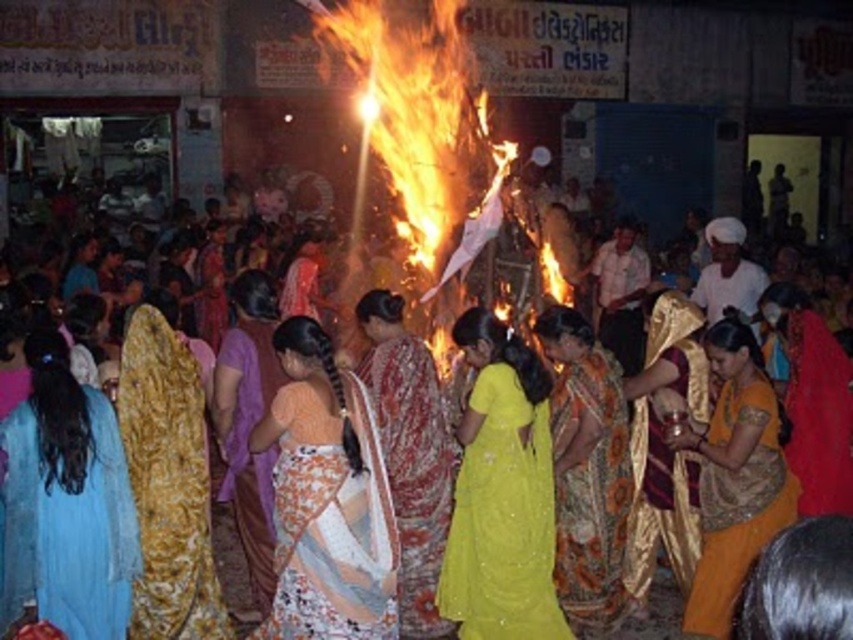
Who is taller, yellow sequined sari at center or yellow silk saree at center?

Standing taller between the two is yellow sequined sari at center.

This screenshot has width=853, height=640. Find the location of `yellow sequined sari at center`. yellow sequined sari at center is located at coordinates (502, 493).

Between yellow silk saree at center and gold shiny saree at center, which one is positioned lower?

Positioned lower is yellow silk saree at center.

Does yellow silk saree at center have a greater width compared to gold shiny saree at center?

Yes, yellow silk saree at center is wider than gold shiny saree at center.

Is point (761, 362) in front of point (706, 369)?

Yes, it is in front of point (706, 369).

This screenshot has width=853, height=640. What are the coordinates of `yellow silk saree at center` in the screenshot? It's located at (735, 477).

Between point (556, 515) and point (251, 321), which one is positioned behind?

Point (251, 321)

Where is `floral silk sari at center`? The height and width of the screenshot is (640, 853). floral silk sari at center is located at coordinates (587, 470).